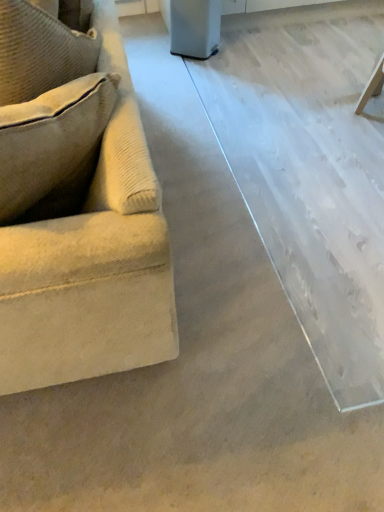
Question: Should I look upward or downward to see beige corduroy couch at left?

Choices:
 (A) down
 (B) up

Answer: (B)